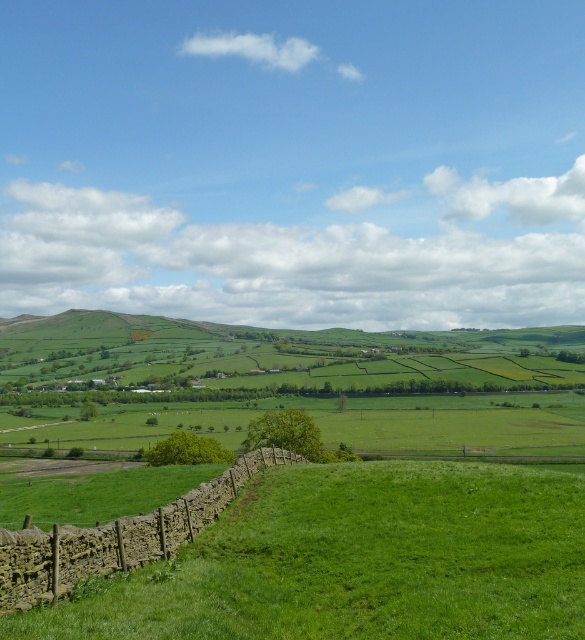
Based on the photo, you are standing in the rural landscape and want to walk towards the green grassy hillside at center. Which direction should you move relative to the green grassy at lower left?

The green grassy at lower left is in front of the green grassy hillside at center, so to reach the hillside, you should move away from the green grassy at lower left towards the background.

You are standing in the rural landscape shown in the image. You notice two points marked in the scene. One is at coordinate point (x=256, y=563) and the other at point (x=512, y=332). Which point is closer to you?

Point (x=256, y=563) is closer to the viewer than point (x=512, y=332), so the first point is nearer.